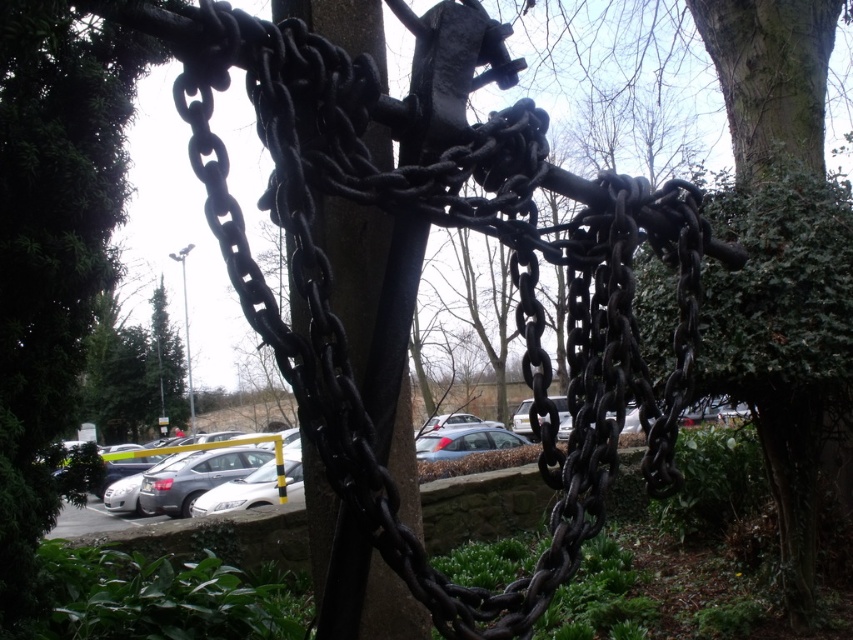
Question: From the image, what is the correct spatial relationship of black metal pole at center in relation to silver metallic car at center?

Choices:
 (A) right
 (B) left

Answer: (A)

Question: Does black metal pole at center appear on the right side of silver metallic car at center?

Choices:
 (A) no
 (B) yes

Answer: (B)

Question: Can you confirm if black metal pole at center is positioned to the right of silver metallic car at center?

Choices:
 (A) yes
 (B) no

Answer: (A)

Question: Which point is farther to the camera?

Choices:
 (A) silver metallic car at center
 (B) black metal pole at center

Answer: (A)

Question: Which object is closer to the camera taking this photo?

Choices:
 (A) silver metallic car at center
 (B) black metal pole at center

Answer: (B)